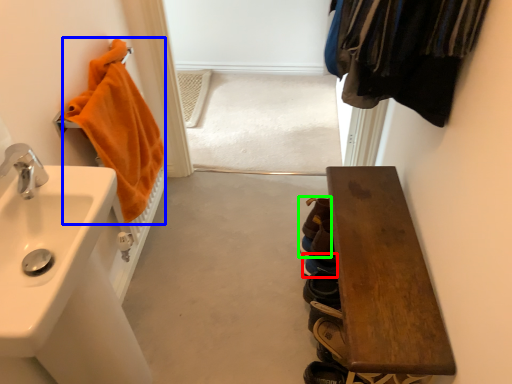
Question: Based on their relative distances, which object is farther from shoe (highlighted by a red box)? Choose from bath towel (highlighted by a blue box) and shoe (highlighted by a green box).

Choices:
 (A) bath towel
 (B) shoe

Answer: (A)